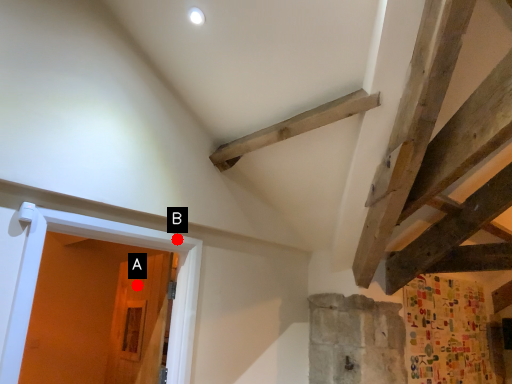
Question: Two points are circled on the image, labeled by A and B beside each circle. Which of the following is the closest to the observer?

Choices:
 (A) A is closer
 (B) B is closer

Answer: (B)